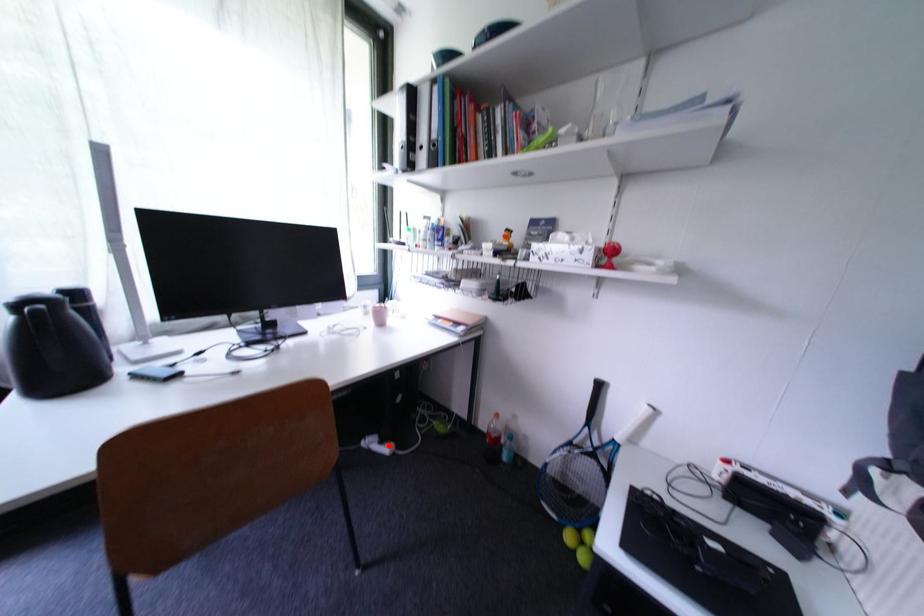
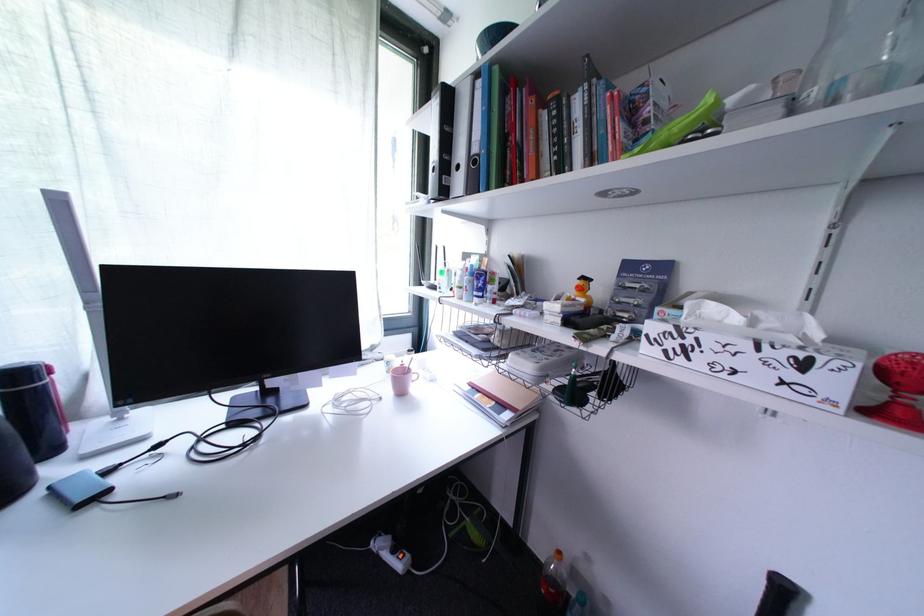
Locate, in the second image, the point that corresponds to the highlighted location in the first image.

(402, 553)